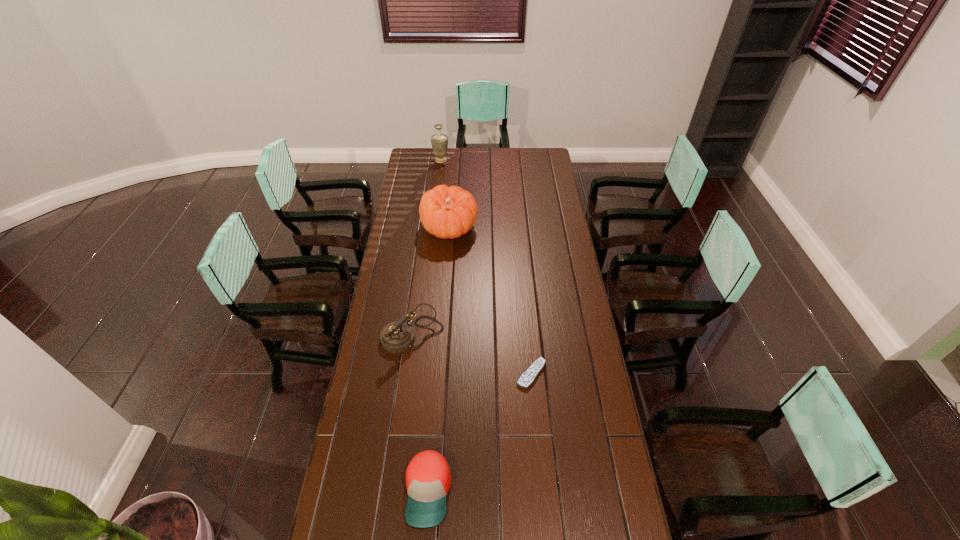
Identify the location of urn. (439, 141).

Where is `the fourth nearest object`? the fourth nearest object is located at coordinates (446, 212).

Where is `the third farthest object`? This screenshot has width=960, height=540. the third farthest object is located at coordinates (396, 337).

The height and width of the screenshot is (540, 960). What are the coordinates of `the third tallest object` in the screenshot? It's located at (396, 337).

Locate an element on the screen. the fourth tallest object is located at coordinates (428, 480).

Locate an element on the screen. This screenshot has height=540, width=960. baseball cap is located at coordinates (428, 480).

I want to click on the rightmost object, so click(528, 377).

At what (x,y) coordinates should I click in order to perform the action: click on the fourth farthest object. Please return your answer as a coordinate pair (x, y). Looking at the image, I should click on (528, 377).

Find the location of a particular element. Image resolution: width=960 pixels, height=540 pixels. vacant space located on the right of the farthest object is located at coordinates (515, 160).

I want to click on free space located on the back of the second farthest object, so click(x=454, y=172).